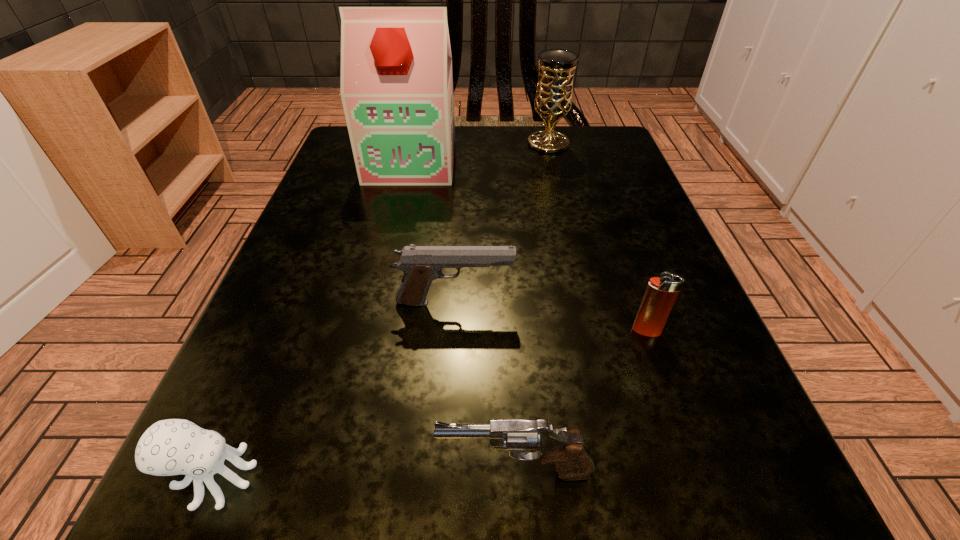
Identify the location of vacant region at the far right corner. This screenshot has width=960, height=540. (607, 147).

In the image, there is a desktop. In order to click on free space at the near right corner in this screenshot , I will do `click(698, 528)`.

This screenshot has width=960, height=540. Identify the location of empty space that is in between the farther pistol and the rightmost object. (550, 316).

The height and width of the screenshot is (540, 960). What are the coordinates of `free space between the soya milk and the nearer pistol` in the screenshot? It's located at (464, 316).

Image resolution: width=960 pixels, height=540 pixels. I want to click on unoccupied position between the igniter and the soya milk, so click(529, 246).

Identify the location of vacant region between the tallest object and the fourth nearest object. This screenshot has height=540, width=960. (433, 232).

This screenshot has height=540, width=960. In order to click on empty space between the leftmost object and the chalice in this screenshot , I will do `click(382, 310)`.

The width and height of the screenshot is (960, 540). I want to click on free spot between the nearer pistol and the tallest object, so click(464, 316).

The image size is (960, 540). What are the coordinates of `free spot between the octopus and the igniter` in the screenshot? It's located at (431, 404).

I want to click on free space between the rightmost object and the soya milk, so click(x=529, y=246).